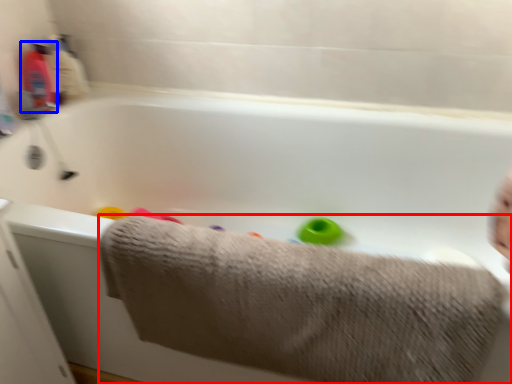
Question: Which of the following is the farthest to the observer, towel (highlighted by a red box) or baby bottle (highlighted by a blue box)?

Choices:
 (A) towel
 (B) baby bottle

Answer: (B)